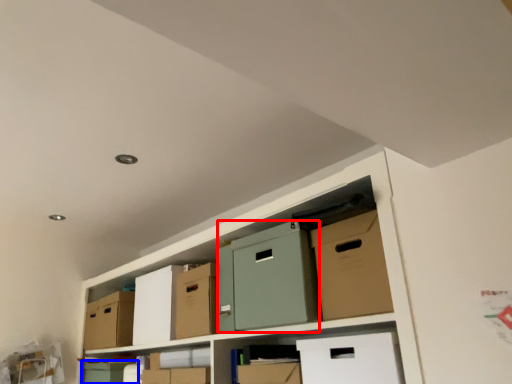
Question: Among these objects, which one is nearest to the camera, wide (highlighted by a red box) or box (highlighted by a blue box)?

Choices:
 (A) wide
 (B) box

Answer: (A)